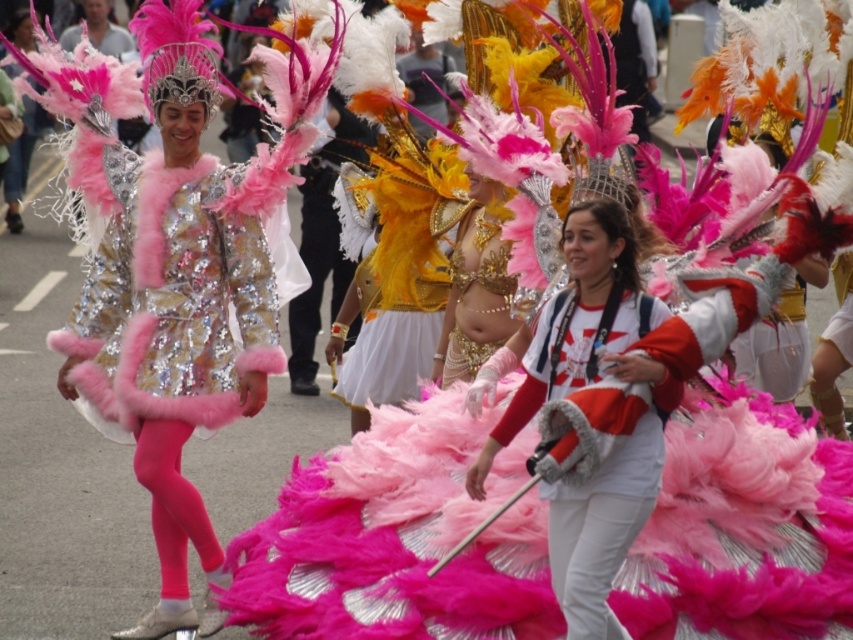
You are a photographer at the parade and want to capture both the matte silver helmet at upper center and the white cotton scarf at center in your shot. Which object should you focus on first if you need to adjust your camera settings for height differences?

The white cotton scarf at center is taller than the matte silver helmet at upper center, so you should focus on adjusting settings for the taller white cotton scarf at center first to ensure proper framing and focus.

You are a photographer trying to capture both the matte silver helmet at upper center and the white cotton scarf at center in a single shot. Based on their thickness, which object would appear narrower in the photo?

The matte silver helmet at upper center is thinner than the white cotton scarf at center, so it would appear narrower in the photo.